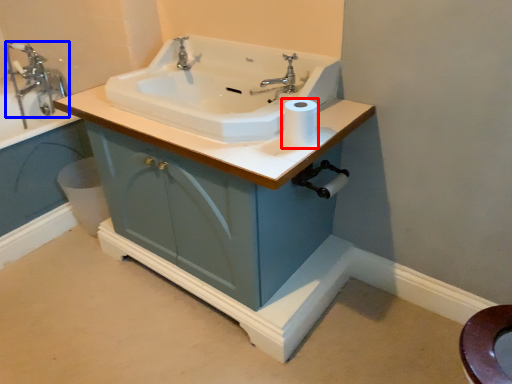
Question: Which point is further to the camera, toilet paper (highlighted by a red box) or tap (highlighted by a blue box)?

Choices:
 (A) toilet paper
 (B) tap

Answer: (B)